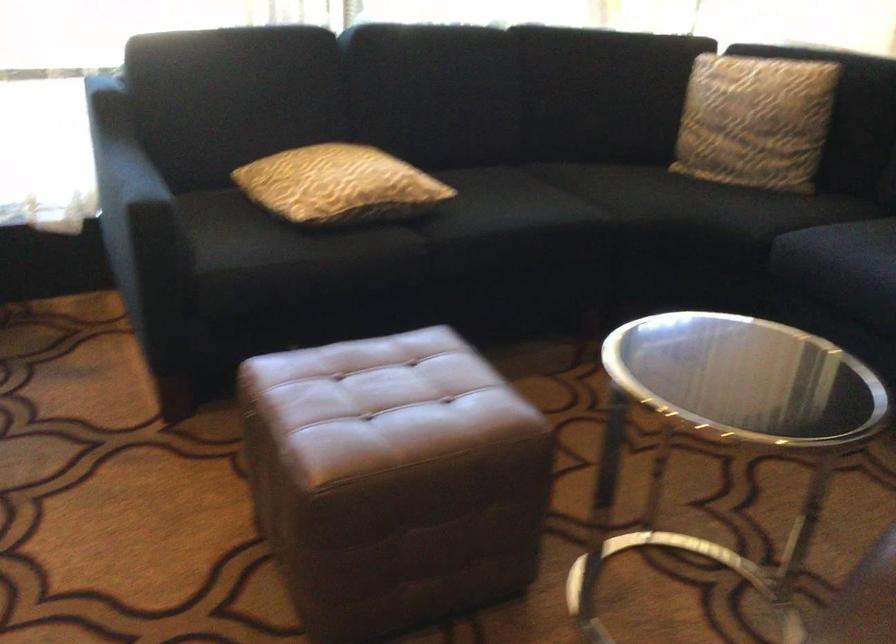
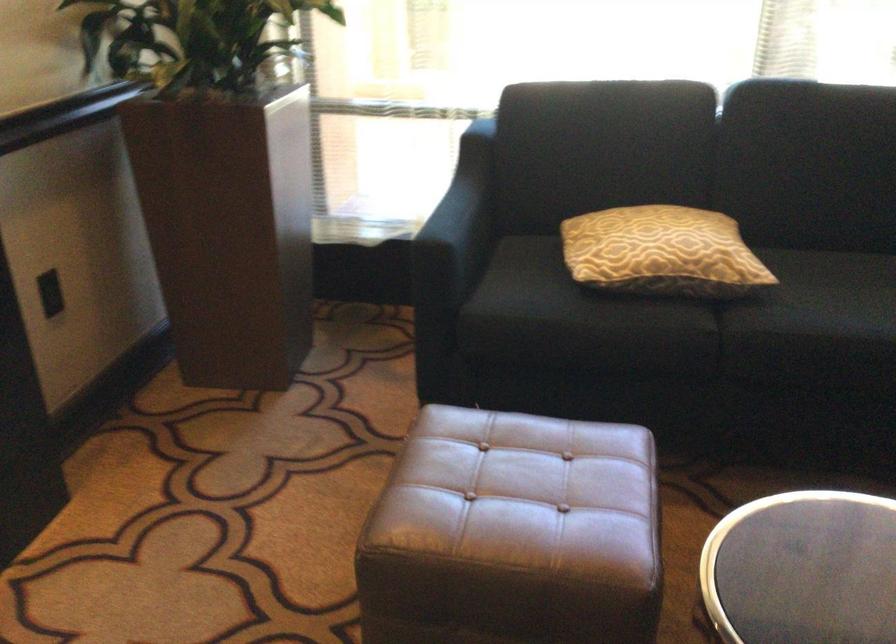
Locate, in the second image, the point that corresponds to pixel 359 185 in the first image.

(661, 252)